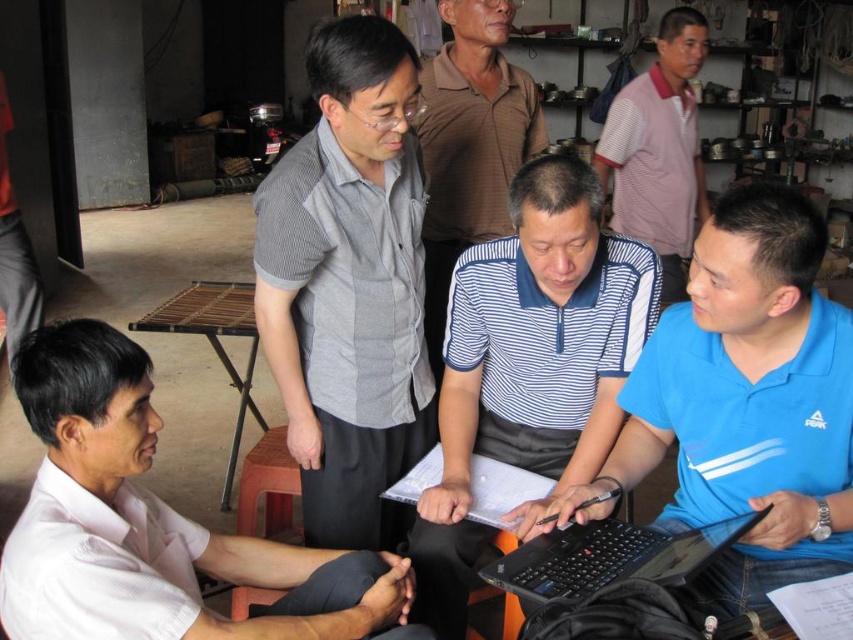
Question: Based on their relative distances, which object is nearer to the white cotton shirt at lower left?

Choices:
 (A) white striped shirt at center
 (B) blue polyester shirt at center
 (C) striped polo shirt at center

Answer: (A)

Question: Among these points, which one is nearest to the camera?

Choices:
 (A) (526, 150)
 (B) (692, 264)
 (C) (532, 195)

Answer: (B)

Question: Can you confirm if white cotton shirt at lower left is positioned to the right of white striped shirt at center?

Choices:
 (A) no
 (B) yes

Answer: (A)

Question: Considering the real-world distances, which object is closest to the striped cotton shirt at center?

Choices:
 (A) gray striped shirt at upper center
 (B) blue polyester shirt at center

Answer: (A)

Question: Is blue polyester shirt at center thinner than white cotton shirt at lower left?

Choices:
 (A) no
 (B) yes

Answer: (B)

Question: Where is blue polyester shirt at center located in relation to white cotton shirt at lower left in the image?

Choices:
 (A) below
 (B) above

Answer: (B)